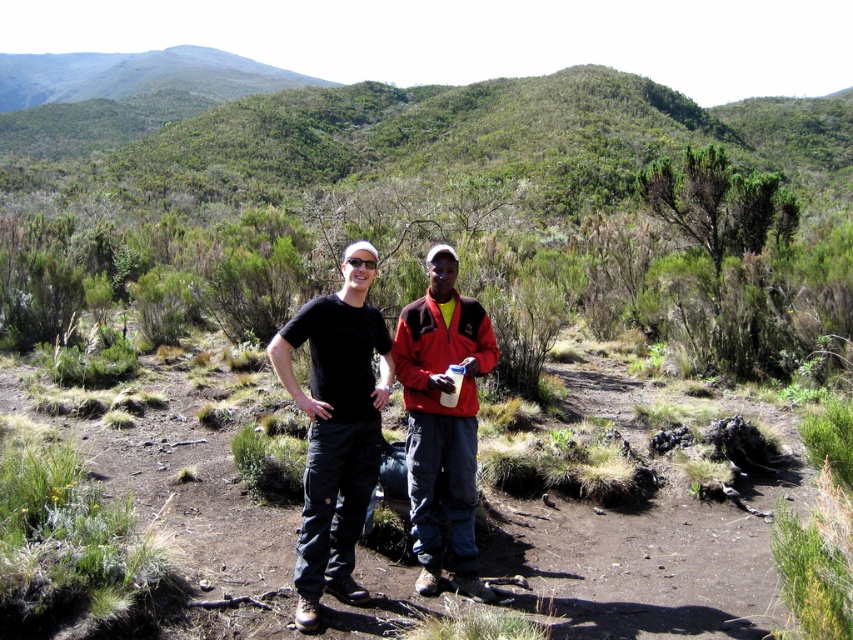
You are planning to take a photo of the two people in the scene. The camera you are using has a focus limit of 1 meter. You need to ensure that both the black fabric pants at center and the red fleece jacket at center are in focus. Given their sizes, which one should you focus on to maximize the chances of both being clear?

Since the black fabric pants at center is larger in size compared to the red fleece jacket at center, focusing on the black fabric pants at center would help ensure both are within the focus range of the camera.

You are a photographer trying to capture a clear shot of the two people in the scene. You notice that the black fabric pants at center and the red fleece jacket at center are close to each other. Which clothing item should you focus on to ensure the subject is sharp, considering their size in the frame?

The black fabric pants at center might be wider than the red fleece jacket at center, so focusing on the black fabric pants at center would be better to ensure the subject is sharp as it has a larger area.